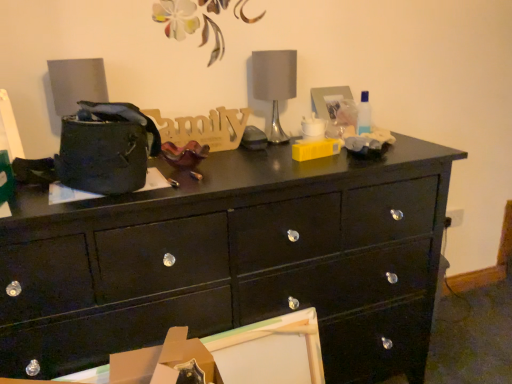
Question: Does satin silver table lamp at center lie in front of glossy black drawer at lower left?

Choices:
 (A) yes
 (B) no

Answer: (B)

Question: Is satin silver table lamp at center shorter than glossy black drawer at lower left?

Choices:
 (A) no
 (B) yes

Answer: (A)

Question: From a real-world perspective, is satin silver table lamp at center below glossy black drawer at lower left?

Choices:
 (A) yes
 (B) no

Answer: (B)

Question: Is satin silver table lamp at center further to camera compared to glossy black drawer at lower left?

Choices:
 (A) no
 (B) yes

Answer: (B)

Question: Is the surface of satin silver table lamp at center in direct contact with glossy black drawer at lower left?

Choices:
 (A) yes
 (B) no

Answer: (B)

Question: From the image's perspective, would you say satin silver table lamp at center is shown under glossy black drawer at lower left?

Choices:
 (A) yes
 (B) no

Answer: (B)

Question: Is cardboard box at lower center smaller than glossy black drawer at lower left?

Choices:
 (A) yes
 (B) no

Answer: (A)

Question: From the image's perspective, is cardboard box at lower center below glossy black drawer at lower left?

Choices:
 (A) yes
 (B) no

Answer: (B)

Question: Is glossy black drawer at lower left completely or partially inside cardboard box at lower center?

Choices:
 (A) no
 (B) yes

Answer: (A)

Question: From the image's perspective, is cardboard box at lower center over glossy black drawer at lower left?

Choices:
 (A) no
 (B) yes

Answer: (B)

Question: Does cardboard box at lower center have a larger size compared to glossy black drawer at lower left?

Choices:
 (A) no
 (B) yes

Answer: (A)

Question: Can you confirm if cardboard box at lower center is shorter than glossy black drawer at lower left?

Choices:
 (A) no
 (B) yes

Answer: (B)

Question: From a real-world perspective, is black glossy chest of drawers at center over glossy black drawer at lower left?

Choices:
 (A) no
 (B) yes

Answer: (A)